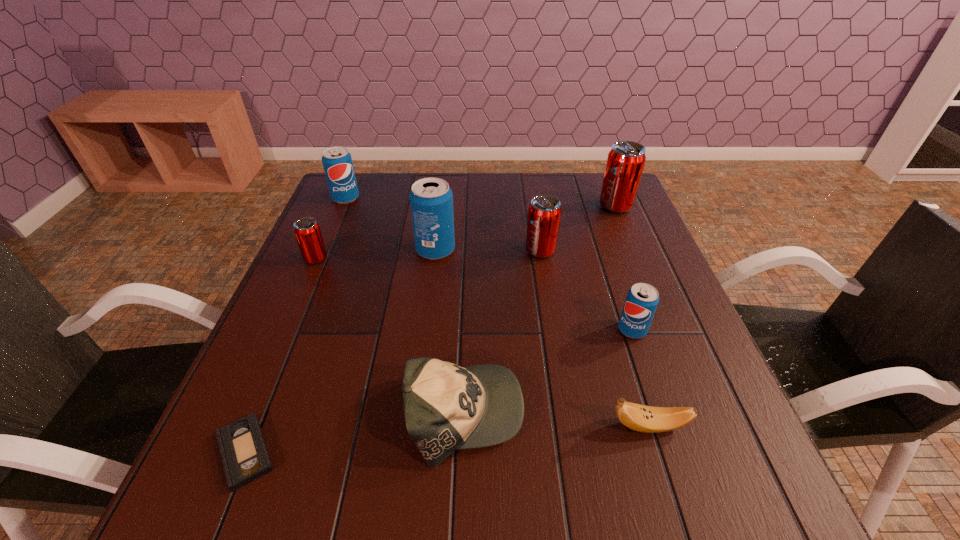
What are the coordinates of `vacant space located on the front-facing side of the baseball cap` in the screenshot? It's located at (566, 414).

Locate an element on the screen. vacant space located 0.130m on the back of the yellow banana is located at coordinates (628, 357).

You are a GUI agent. You are given a task and a screenshot of the screen. Output one action in this format:
    pyautogui.click(x=<x>, y=<y>)
    Task: Click on the vacant space located 0.140m on the back of the videotape
    The height and width of the screenshot is (540, 960).
    Given the screenshot: What is the action you would take?
    pyautogui.click(x=285, y=355)

You are a GUI agent. You are given a task and a screenshot of the screen. Output one action in this format:
    pyautogui.click(x=<x>, y=<y>)
    Task: Click on the baseball cap present at the near edge
    Image resolution: width=960 pixels, height=540 pixels.
    Given the screenshot: What is the action you would take?
    pyautogui.click(x=446, y=407)

Identify the location of videotape that is at the near edge. (245, 456).

What are the coordinates of `videotape at the left edge` in the screenshot? It's located at (245, 456).

You are a GUI agent. You are given a task and a screenshot of the screen. Output one action in this format:
    pyautogui.click(x=<x>, y=<y>)
    Task: Click on the banana that is at the right edge
    
    Given the screenshot: What is the action you would take?
    pyautogui.click(x=647, y=419)

In order to click on object that is positioned at the far left corner in this screenshot , I will do `click(337, 162)`.

You are a GUI agent. You are given a task and a screenshot of the screen. Output one action in this format:
    pyautogui.click(x=<x>, y=<y>)
    Task: Click on the object that is at the near left corner
    Image resolution: width=960 pixels, height=540 pixels.
    Given the screenshot: What is the action you would take?
    pyautogui.click(x=245, y=456)

Identify the location of object that is at the far right corner. This screenshot has width=960, height=540. (625, 163).